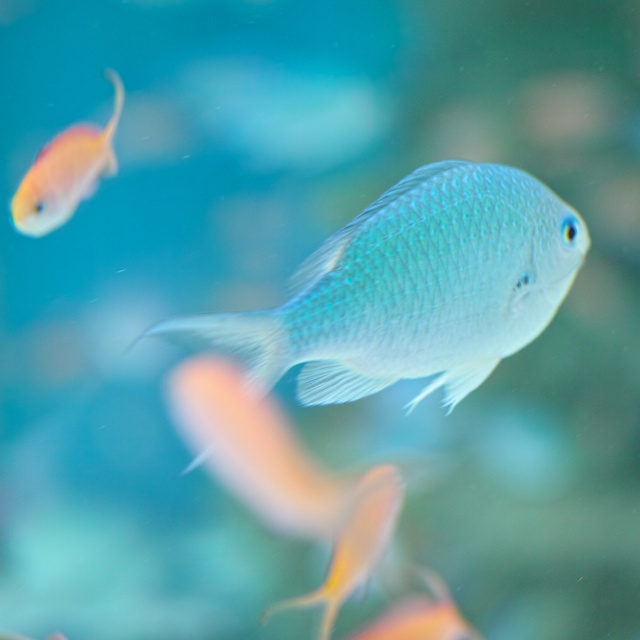
Can you confirm if shiny blue fish at center is positioned to the left of translucent pinkish-yellow fish at upper left?

Incorrect, shiny blue fish at center is not on the left side of translucent pinkish-yellow fish at upper left.

Does point (474, 348) lie in front of point (88, 193)?

Yes, point (474, 348) is closer to viewer.

In order to click on shiny blue fish at center in this screenshot , I will do `click(413, 289)`.

Identify the location of shiny blue fish at center. (413, 289).

Between translucent pinkish-yellow fish at upper left and translucent yellowish fish at center, which one has less height?

translucent yellowish fish at center

Is point (93, 156) more distant than point (378, 488)?

That is True.

Is point (104, 134) in front of point (362, 577)?

No, it is behind (362, 577).

At what (x,y) coordinates should I click in order to perform the action: click on translucent pinkish-yellow fish at upper left. Please return your answer as a coordinate pair (x, y). This screenshot has width=640, height=640. Looking at the image, I should click on (65, 172).

Is shiny blue fish at center below translucent yellowish fish at center?

Incorrect, shiny blue fish at center is not positioned below translucent yellowish fish at center.

Which is in front, point (472, 333) or point (369, 492)?

Positioned in front is point (472, 333).

Identify the location of shiny blue fish at center. (413, 289).